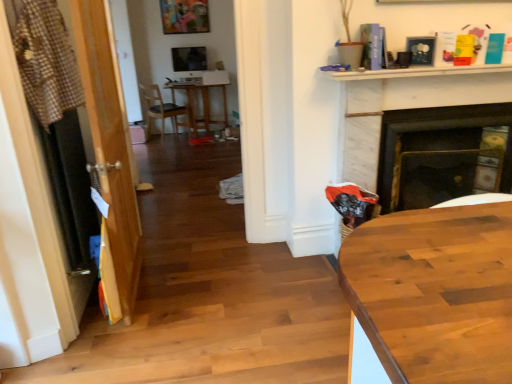
Question: Considering the relative sizes of matte black picture frame at upper right and matte wood chair at center in the image provided, is matte black picture frame at upper right smaller than matte wood chair at center?

Choices:
 (A) yes
 (B) no

Answer: (A)

Question: Considering the relative positions of matte black picture frame at upper right and matte wood chair at center in the image provided, is matte black picture frame at upper right to the right of matte wood chair at center from the viewer's perspective?

Choices:
 (A) yes
 (B) no

Answer: (A)

Question: From a real-world perspective, is matte black picture frame at upper right physically above matte wood chair at center?

Choices:
 (A) no
 (B) yes

Answer: (B)

Question: Does matte black picture frame at upper right have a greater width compared to matte wood chair at center?

Choices:
 (A) yes
 (B) no

Answer: (B)

Question: Does matte black picture frame at upper right have a lesser height compared to matte wood chair at center?

Choices:
 (A) no
 (B) yes

Answer: (B)

Question: Does point (176, 49) appear closer or farther from the camera than point (160, 104)?

Choices:
 (A) closer
 (B) farther

Answer: (A)

Question: In terms of width, does satin black monitor at center look wider or thinner when compared to matte wood chair at center?

Choices:
 (A) thin
 (B) wide

Answer: (A)

Question: From a real-world perspective, is satin black monitor at center physically located above or below matte wood chair at center?

Choices:
 (A) above
 (B) below

Answer: (A)

Question: Visually, is satin black monitor at center positioned to the left or to the right of matte wood chair at center?

Choices:
 (A) left
 (B) right

Answer: (B)

Question: In terms of size, does matte black picture frame at upper right appear bigger or smaller than wooden door at left?

Choices:
 (A) big
 (B) small

Answer: (B)

Question: Is matte black picture frame at upper right inside or outside of wooden door at left?

Choices:
 (A) outside
 (B) inside

Answer: (A)

Question: Considering the positions of matte black picture frame at upper right and wooden door at left in the image, is matte black picture frame at upper right wider or thinner than wooden door at left?

Choices:
 (A) wide
 (B) thin

Answer: (B)

Question: Is point (409, 51) positioned closer to the camera than point (100, 61)?

Choices:
 (A) farther
 (B) closer

Answer: (A)

Question: Is point (175, 56) closer or farther from the camera than point (117, 271)?

Choices:
 (A) farther
 (B) closer

Answer: (A)

Question: From their relative heights in the image, would you say satin black monitor at center is taller or shorter than wooden door at left?

Choices:
 (A) tall
 (B) short

Answer: (B)